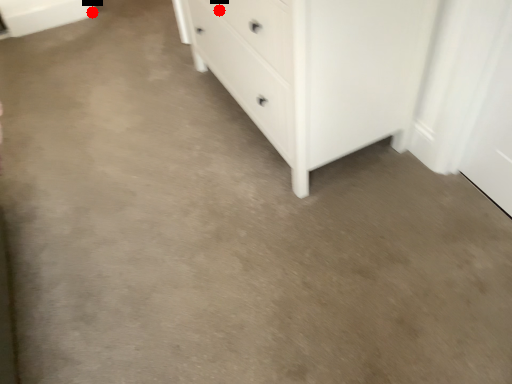
Question: Two points are circled on the image, labeled by A and B beside each circle. Which point appears farthest from the camera in this image?

Choices:
 (A) A is further
 (B) B is further

Answer: (B)